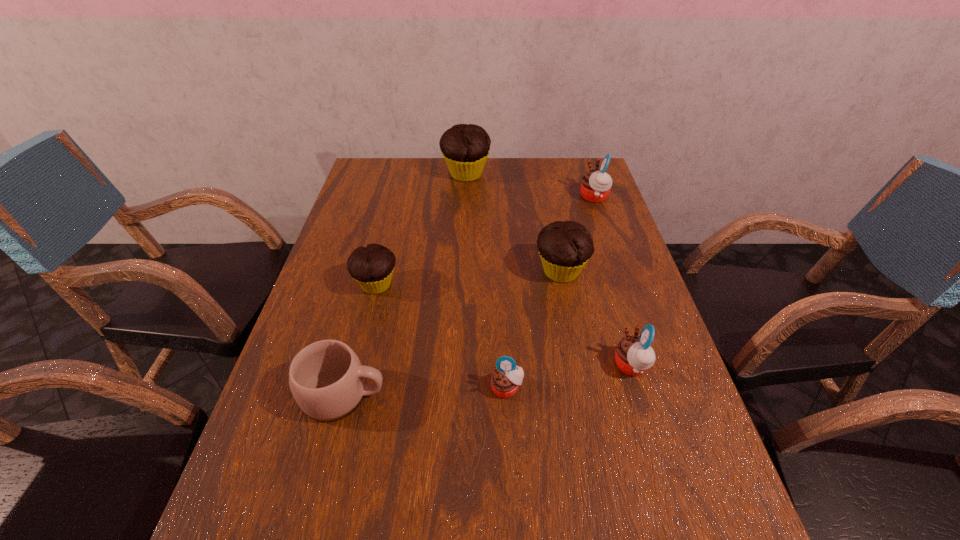
Locate an element on the screen. empty space between the farthest muffin and the leftmost muffin is located at coordinates (421, 230).

The image size is (960, 540). Identify the location of vacant point located between the farthest pink muffin and the second chocolate muffin from right to left. (530, 186).

Where is `free space between the fifth object from left to right and the second chocolate muffin from right to left`? The width and height of the screenshot is (960, 540). free space between the fifth object from left to right and the second chocolate muffin from right to left is located at coordinates (514, 222).

Find the location of a particular element. empty location between the second smallest pink muffin and the mug is located at coordinates (488, 380).

Identify the location of free space between the second biggest pink muffin and the shortest object. The image size is (960, 540). (569, 377).

The width and height of the screenshot is (960, 540). Identify the location of object that stands as the fifth closest to the leftmost pink muffin. (596, 185).

You are a GUI agent. You are given a task and a screenshot of the screen. Output one action in this format:
    pyautogui.click(x=<x>, y=<y>)
    Task: Click on the object that is the closest to the leftmost muffin
    
    Given the screenshot: What is the action you would take?
    pyautogui.click(x=326, y=378)

Point out which muffin is positioned as the second nearest to the second biggest pink muffin. Please provide its 2D coordinates. Your answer should be formatted as a tuple, i.e. [(x, y)], where the tuple contains the x and y coordinates of a point satisfying the conditions above.

[(507, 376)]

Identify which muffin is located as the third nearest to the mug. Please provide its 2D coordinates. Your answer should be formatted as a tuple, i.e. [(x, y)], where the tuple contains the x and y coordinates of a point satisfying the conditions above.

[(565, 247)]

What are the coordinates of `chocolate muffin that is the closest to the smallest chocolate muffin` in the screenshot? It's located at (565, 247).